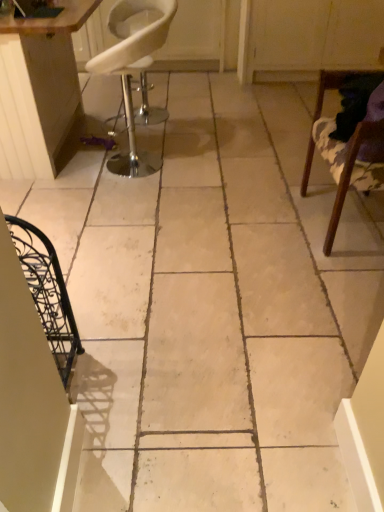
The width and height of the screenshot is (384, 512). Identify the location of free region on the left part of white plastic chair at upper left, marked as the 2th chair in a right-to-left arrangement. (81, 167).